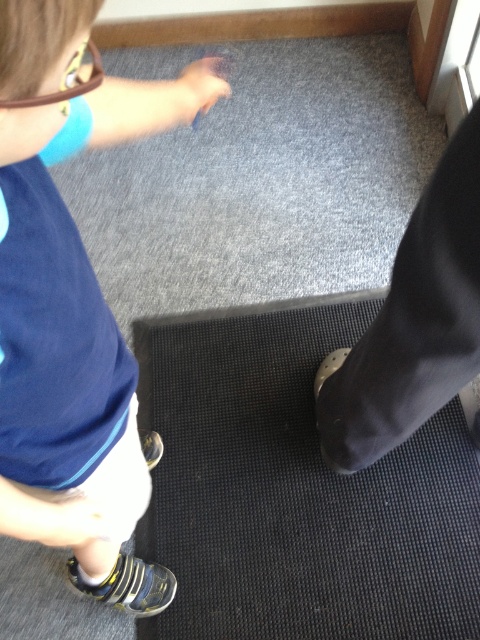
Is point (177, 362) farther from viewer compared to point (21, 189)?

Yes.

Can you confirm if black rubber mat at lower center is positioned above blue fabric shirt at upper left?

No, black rubber mat at lower center is not above blue fabric shirt at upper left.

Identify the location of black rubber mat at lower center. This screenshot has width=480, height=640. (296, 490).

Locate an element on the screen. The image size is (480, 640). black rubber mat at lower center is located at coordinates (296, 490).